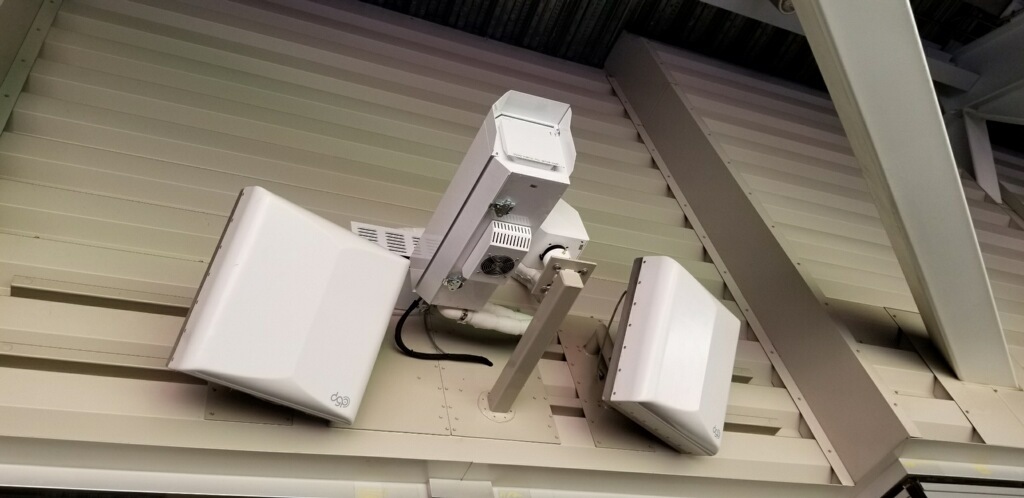
Identify the location of lights. (669, 345), (339, 317).